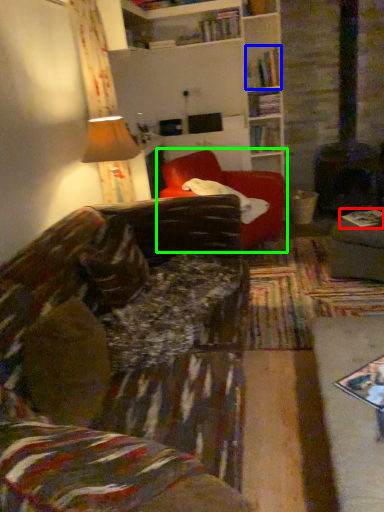
Question: Considering the real-world distances, which object is closest to book (highlighted by a red box)? book (highlighted by a blue box) or studio couch (highlighted by a green box).

Choices:
 (A) book
 (B) studio couch

Answer: (B)